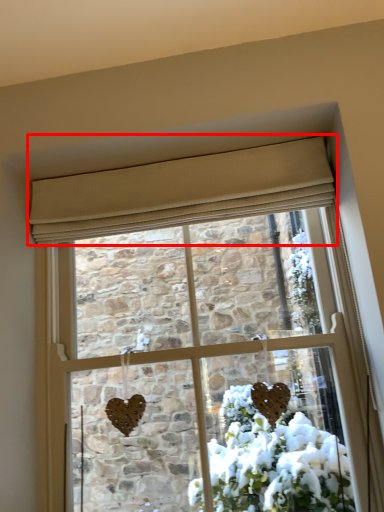
Question: From the image's perspective, considering the relative positions of curtain (annotated by the red box) and window in the image provided, where is curtain (annotated by the red box) located with respect to the staircase?

Choices:
 (A) above
 (B) below

Answer: (A)